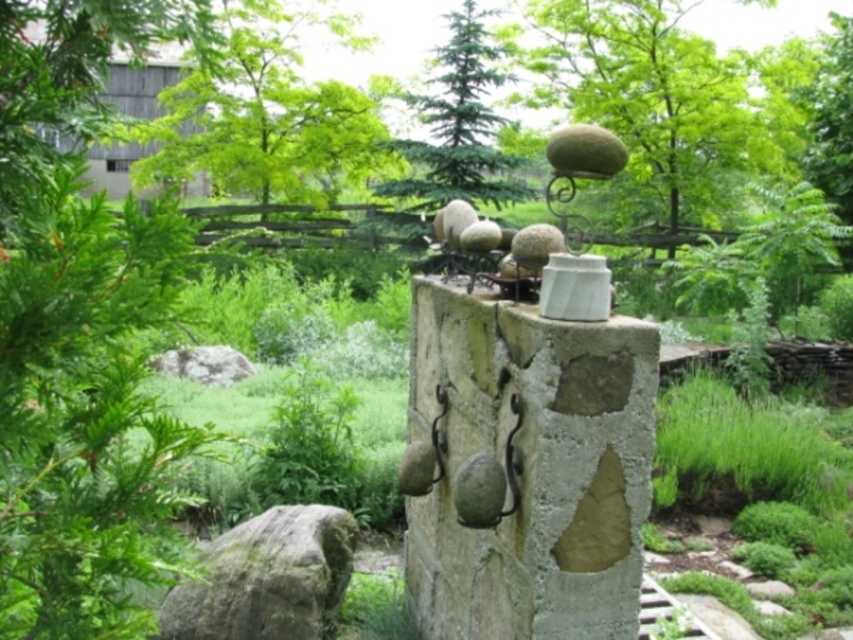
Question: Is green mossy rock at lower left to the right of green textured pine tree at center from the viewer's perspective?

Choices:
 (A) yes
 (B) no

Answer: (B)

Question: Is natural stone wall at center in front of green textured sphere at upper center?

Choices:
 (A) no
 (B) yes

Answer: (B)

Question: Which point appears farthest from the camera in this image?

Choices:
 (A) click(132, 492)
 (B) click(831, 154)
 (C) click(701, 216)

Answer: (C)

Question: Which point is farther to the camera?

Choices:
 (A) (425, 173)
 (B) (318, 196)
 (C) (274, 636)
 (D) (126, 410)

Answer: (B)

Question: Does natural stone wall at center appear on the right side of green textured sphere at upper center?

Choices:
 (A) no
 (B) yes

Answer: (A)

Question: Among these points, which one is nearest to the camera?

Choices:
 (A) (479, 33)
 (B) (83, 125)

Answer: (B)